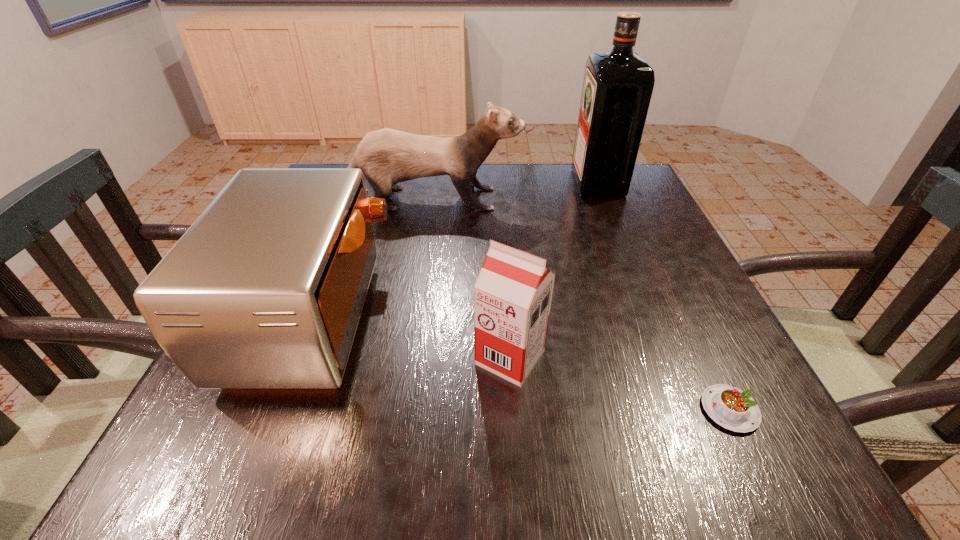
What are the coordinates of `object at the far right corner` in the screenshot? It's located at (617, 88).

Where is `object that is at the near right corner`? This screenshot has height=540, width=960. object that is at the near right corner is located at coordinates (733, 409).

In the image, there is a desktop. Where is `vacant space at the far edge`? The height and width of the screenshot is (540, 960). vacant space at the far edge is located at coordinates (495, 177).

At what (x,y) coordinates should I click in order to perform the action: click on vacant space at the near edge of the desktop. Please return your answer as a coordinate pair (x, y). Image resolution: width=960 pixels, height=540 pixels. Looking at the image, I should click on (488, 469).

Find the location of a particular element. The height and width of the screenshot is (540, 960). vacant area at the far right corner of the desktop is located at coordinates (624, 198).

Locate an element on the screen. The height and width of the screenshot is (540, 960). vacant space at the near right corner of the desktop is located at coordinates (702, 441).

Where is `vacant space that is in between the liquor and the shortest object`? vacant space that is in between the liquor and the shortest object is located at coordinates (663, 296).

Locate an element on the screen. empty space that is in between the soya milk and the shortest object is located at coordinates (620, 383).

I want to click on vacant area between the pudding and the soya milk, so click(x=620, y=383).

Where is `vacant area between the ferret and the soya milk`? The width and height of the screenshot is (960, 540). vacant area between the ferret and the soya milk is located at coordinates (463, 278).